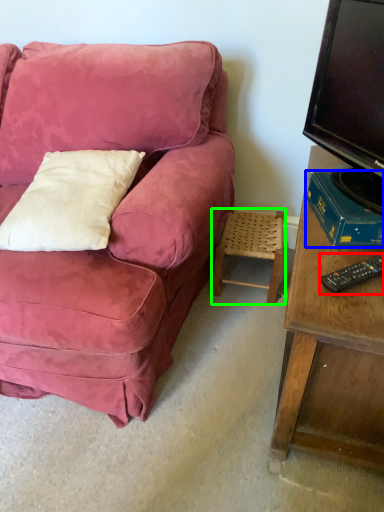
Question: Considering the real-world distances, which object is farthest from remote control (highlighted by a red box)? book (highlighted by a blue box) or stool (highlighted by a green box)?

Choices:
 (A) book
 (B) stool

Answer: (B)